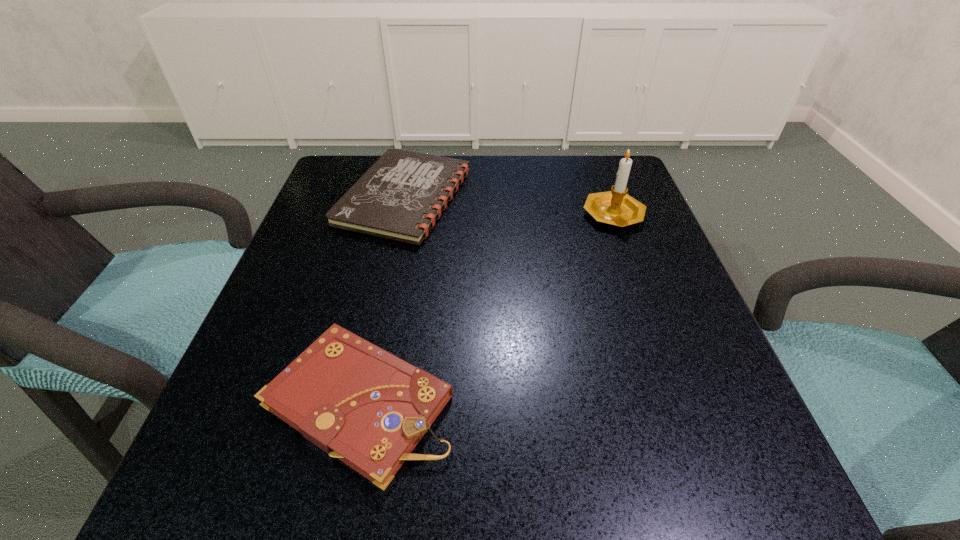
You are a GUI agent. You are given a task and a screenshot of the screen. Output one action in this format:
    pyautogui.click(x=<x>, y=<y>)
    Task: Click on the free space between the shortest object and the nearest object
    The image size is (960, 540).
    Given the screenshot: What is the action you would take?
    pyautogui.click(x=381, y=299)

At what (x,y) coordinates should I click in order to perform the action: click on blank region between the shortest object and the tallest object. Please return your answer as a coordinate pair (x, y). Looking at the image, I should click on (509, 205).

The image size is (960, 540). In order to click on empty space that is in between the candle holder and the farther notebook in this screenshot , I will do `click(509, 205)`.

You are a GUI agent. You are given a task and a screenshot of the screen. Output one action in this format:
    pyautogui.click(x=<x>, y=<y>)
    Task: Click on the vacant space that's between the rightmost object and the farther notebook
    The width and height of the screenshot is (960, 540).
    Given the screenshot: What is the action you would take?
    509,205

Locate an element on the screen. The height and width of the screenshot is (540, 960). free spot between the nearer notebook and the rightmost object is located at coordinates (486, 307).

Image resolution: width=960 pixels, height=540 pixels. Find the location of `free space between the nearer notebook and the candle holder`. free space between the nearer notebook and the candle holder is located at coordinates (486, 307).

Locate an element on the screen. free spot between the rightmost object and the nearest object is located at coordinates 486,307.

Where is `vacant region between the farther notebook and the rightmost object`? vacant region between the farther notebook and the rightmost object is located at coordinates (509, 205).

Identify the location of free point between the shorter notebook and the rightmost object. This screenshot has height=540, width=960. (509, 205).

Locate an element on the screen. This screenshot has width=960, height=540. free space that is in between the nearest object and the shortest object is located at coordinates (381, 299).